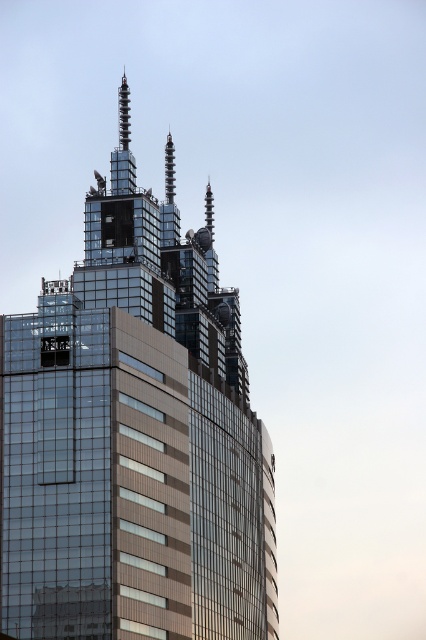
Question: Does glassy metallic skyscraper at center appear on the right side of sleek silver spire at upper center?

Choices:
 (A) no
 (B) yes

Answer: (A)

Question: Which is farther from the sleek silver spire at upper center?

Choices:
 (A) glassy metallic skyscraper at center
 (B) shiny metallic spire at center

Answer: (A)

Question: Which of the following is the farthest from the observer?

Choices:
 (A) sleek silver spire at upper center
 (B) glassy metallic skyscraper at center
 (C) shiny metallic spire at center

Answer: (A)

Question: From the image, what is the correct spatial relationship of shiny metallic spire at center in relation to sleek silver spire at upper center?

Choices:
 (A) below
 (B) above

Answer: (B)

Question: Is glassy metallic skyscraper at center bigger than shiny metallic spire at center?

Choices:
 (A) yes
 (B) no

Answer: (A)

Question: Among these points, which one is farthest from the camera?

Choices:
 (A) (169, 145)
 (B) (238, 324)
 (C) (212, 195)

Answer: (C)